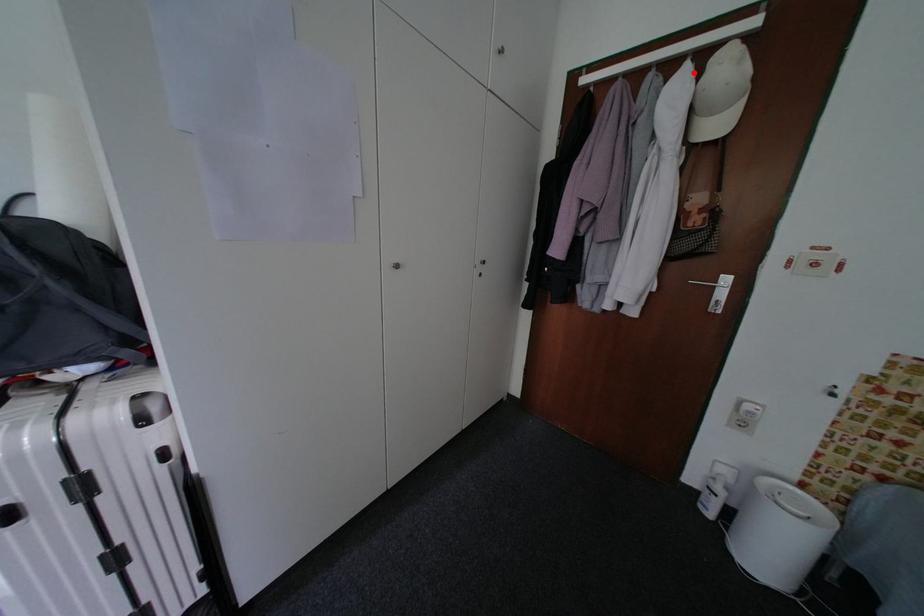
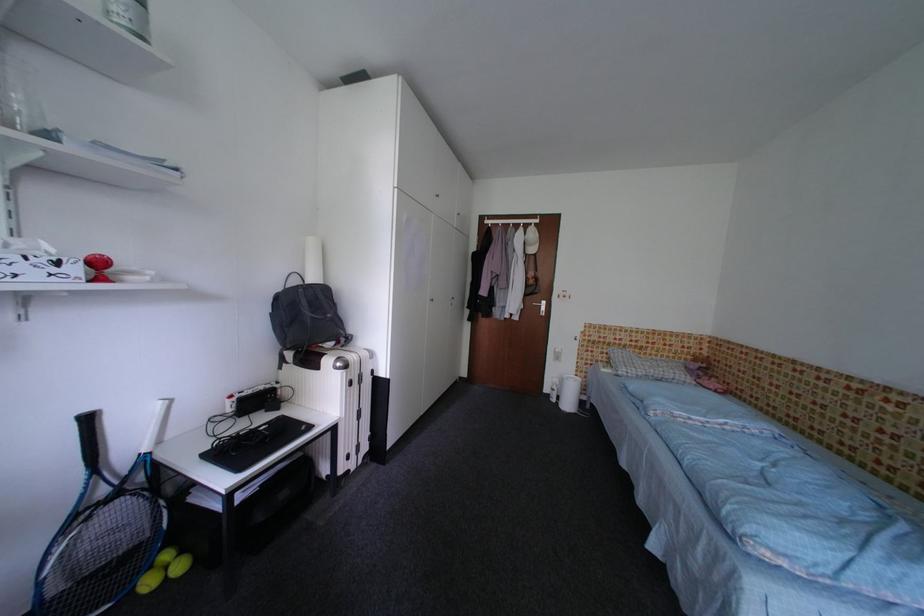
Question: I am providing you with two images of the same scene from different viewpoints. In image1, a red point is highlighted. Considering the same 3D point in image2, which of the following is correct?

Choices:
 (A) It is closer
 (B) It is farther

Answer: (A)